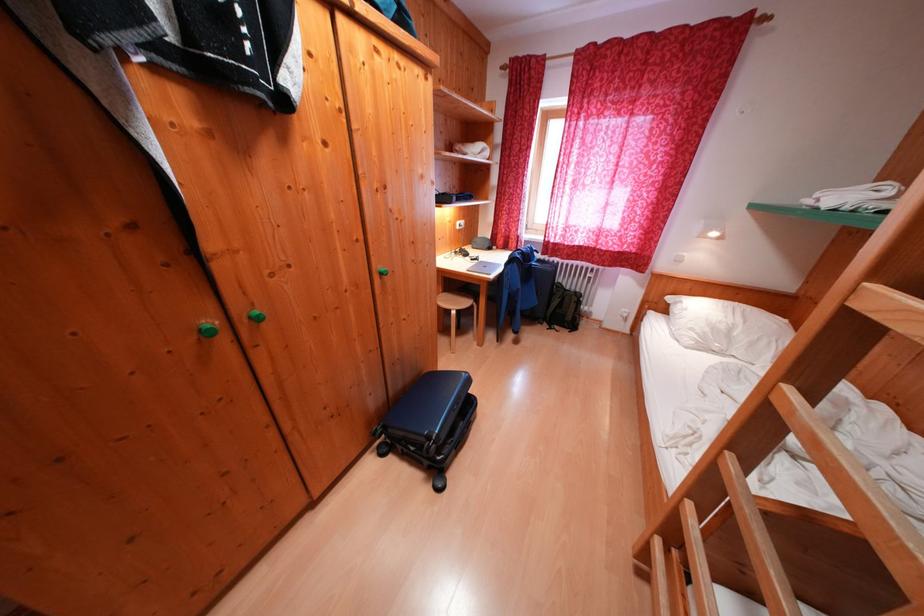
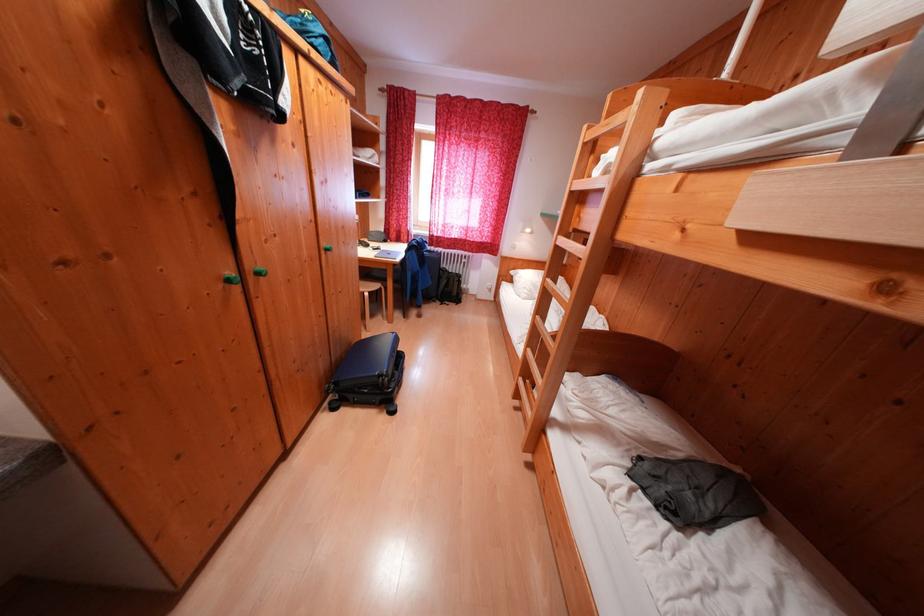
Where in the second image is the point corresponding to (x=568, y=291) from the first image?

(454, 275)